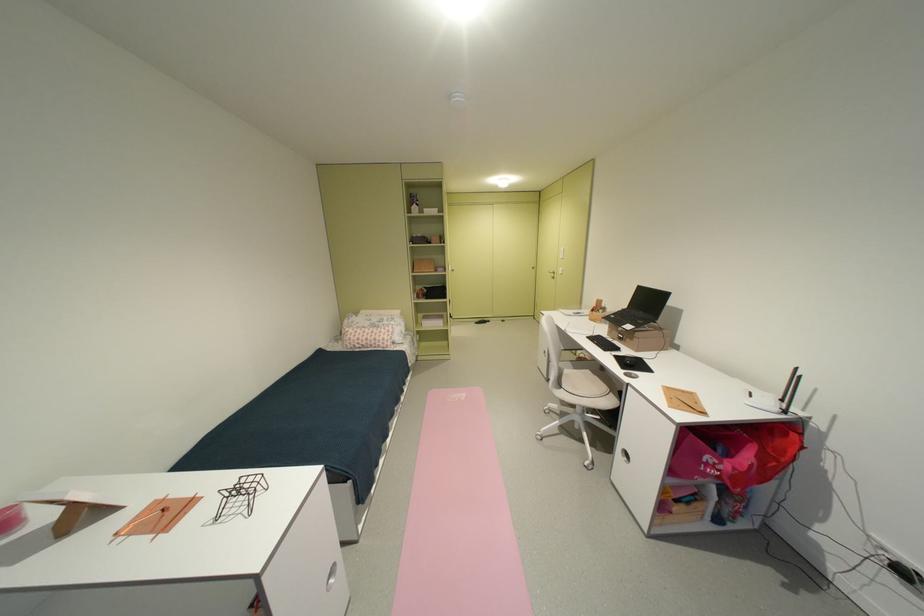
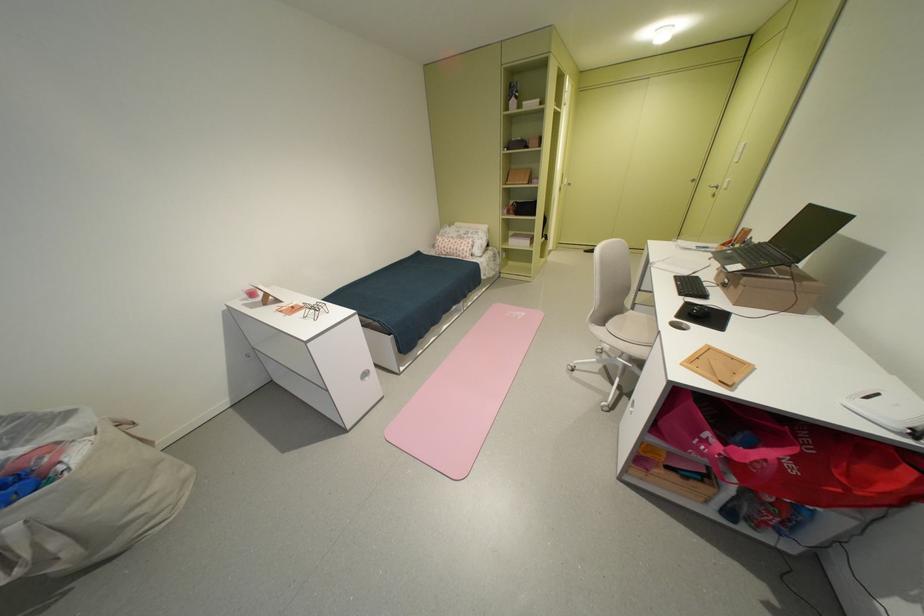
Locate, in the second image, the point that corresponds to (471,398) in the first image.

(530, 315)